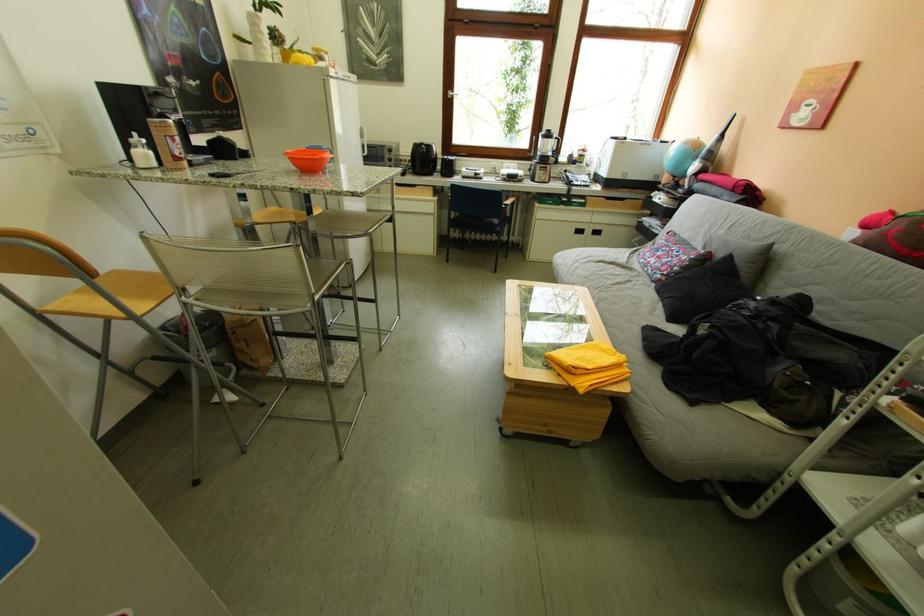
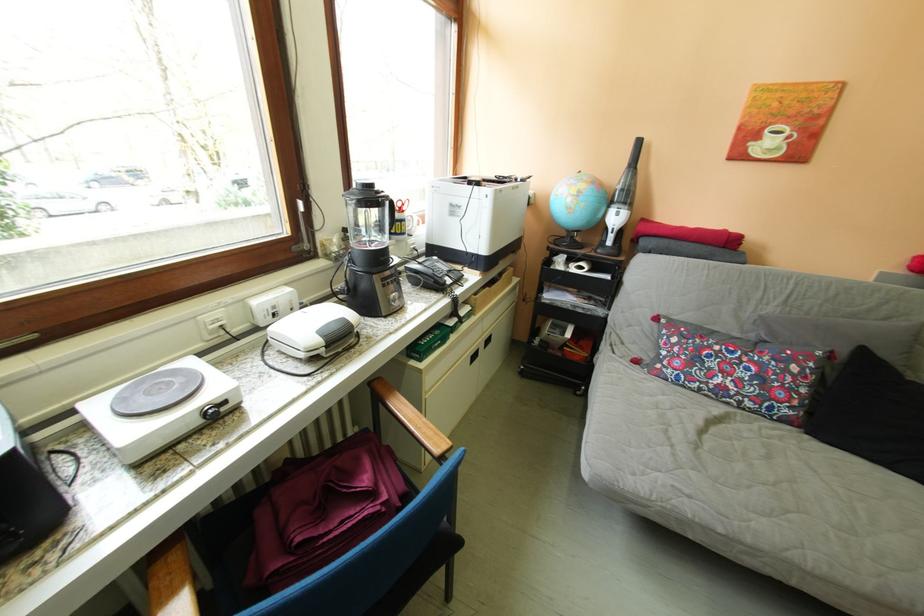
The point at [669,290] is marked in the first image. Where is the corresponding point in the second image?

(821, 437)